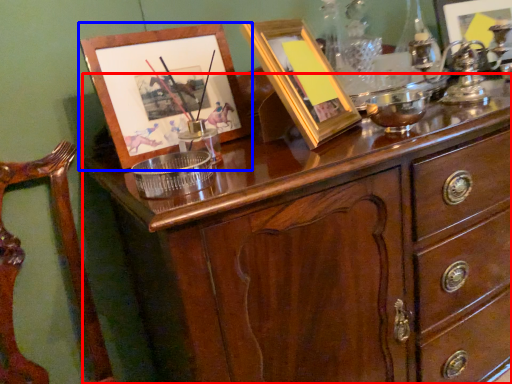
Question: Which point is further to the camera, chest of drawers (highlighted by a red box) or picture frame (highlighted by a blue box)?

Choices:
 (A) chest of drawers
 (B) picture frame

Answer: (B)